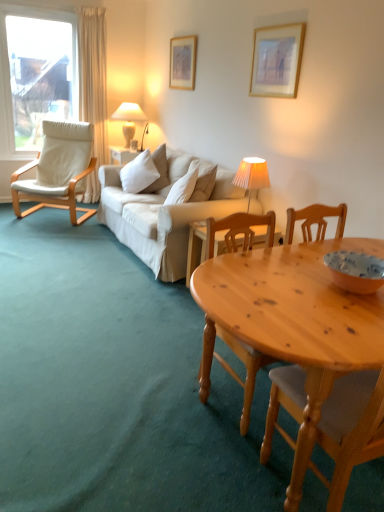
This screenshot has width=384, height=512. I want to click on free space in front of white fabric chair at left, so click(49, 234).